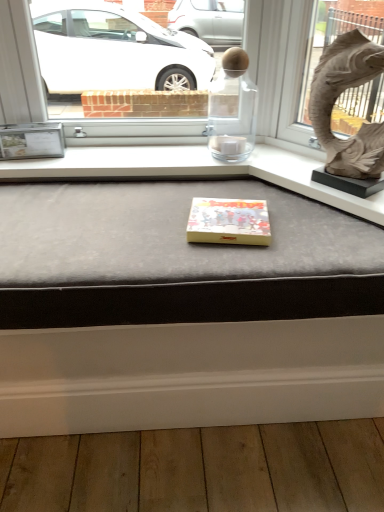
Question: Is yellow matte box at center bigger than matte stone animal at upper right?

Choices:
 (A) yes
 (B) no

Answer: (B)

Question: Does yellow matte box at center turn towards matte stone animal at upper right?

Choices:
 (A) yes
 (B) no

Answer: (B)

Question: Considering the relative sizes of yellow matte box at center and matte stone animal at upper right in the image provided, is yellow matte box at center shorter than matte stone animal at upper right?

Choices:
 (A) no
 (B) yes

Answer: (B)

Question: Is yellow matte box at center positioned far away from matte stone animal at upper right?

Choices:
 (A) no
 (B) yes

Answer: (A)

Question: Is yellow matte box at center looking in the opposite direction of matte stone animal at upper right?

Choices:
 (A) yes
 (B) no

Answer: (B)

Question: Is matte stone animal at upper right wider or thinner than matte gray cushion at center?

Choices:
 (A) wide
 (B) thin

Answer: (B)

Question: From a real-world perspective, is matte stone animal at upper right physically located above or below matte gray cushion at center?

Choices:
 (A) below
 (B) above

Answer: (B)

Question: Is matte stone animal at upper right bigger or smaller than matte gray cushion at center?

Choices:
 (A) big
 (B) small

Answer: (B)

Question: Considering their positions, is matte stone animal at upper right located in front of or behind matte gray cushion at center?

Choices:
 (A) behind
 (B) front

Answer: (A)

Question: Is yellow matte box at center bigger or smaller than matte stone animal at upper right?

Choices:
 (A) small
 (B) big

Answer: (A)

Question: From a real-world perspective, is yellow matte box at center physically located above or below matte stone animal at upper right?

Choices:
 (A) above
 (B) below

Answer: (B)

Question: Is yellow matte box at center to the left or to the right of matte stone animal at upper right in the image?

Choices:
 (A) left
 (B) right

Answer: (A)

Question: Is yellow matte box at center spatially inside matte stone animal at upper right, or outside of it?

Choices:
 (A) inside
 (B) outside

Answer: (B)

Question: Considering the positions of matte gray cushion at center and yellow matte box at center in the image, is matte gray cushion at center wider or thinner than yellow matte box at center?

Choices:
 (A) thin
 (B) wide

Answer: (B)

Question: In terms of height, does matte gray cushion at center look taller or shorter compared to yellow matte box at center?

Choices:
 (A) short
 (B) tall

Answer: (B)